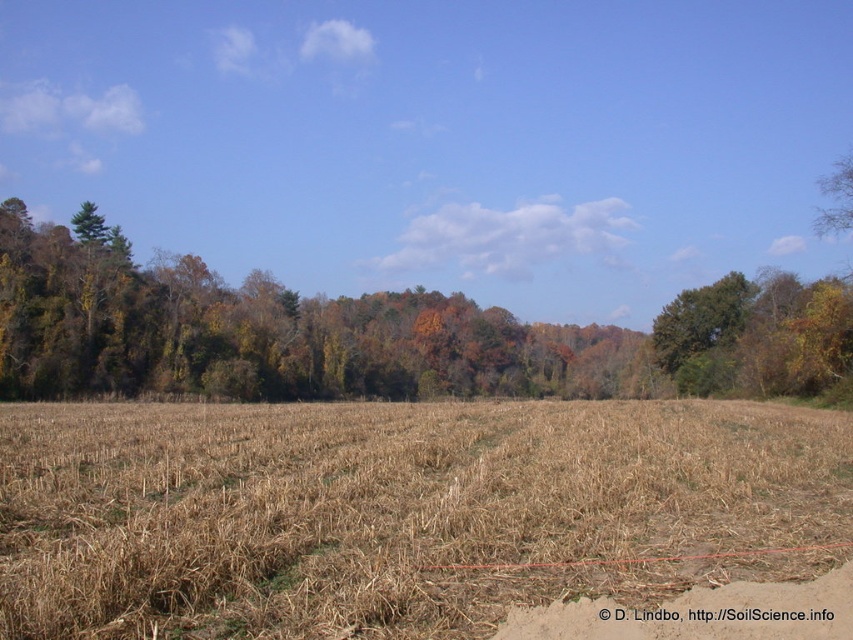
Consider the image. You are standing at the center of the field and want to find the brown dirt track at lower center. According to the coordinates provided, in which direction should you walk to reach it?

The brown dirt track at lower center is located at coordinates point (701, 612), so you should walk towards the lower center direction to reach it.

You are a farmer checking your field. You see the brown dry grass at center and the brown dirt track at lower center. Which one is taller?

The brown dry grass at center is much taller than the brown dirt track at lower center.